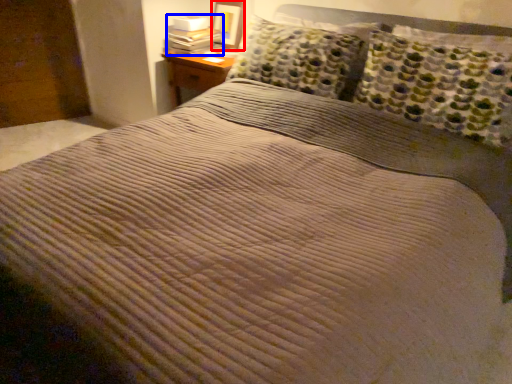
Question: Which point is further to the camera, picture frame (highlighted by a red box) or book (highlighted by a blue box)?

Choices:
 (A) picture frame
 (B) book

Answer: (A)